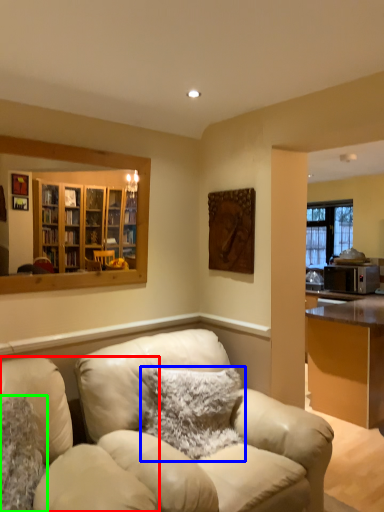
Question: Estimate the real-world distances between objects in this image. Which object is closer to chair (highlighted by a red box), pillow (highlighted by a blue box) or pillow (highlighted by a green box)?

Choices:
 (A) pillow
 (B) pillow

Answer: (B)